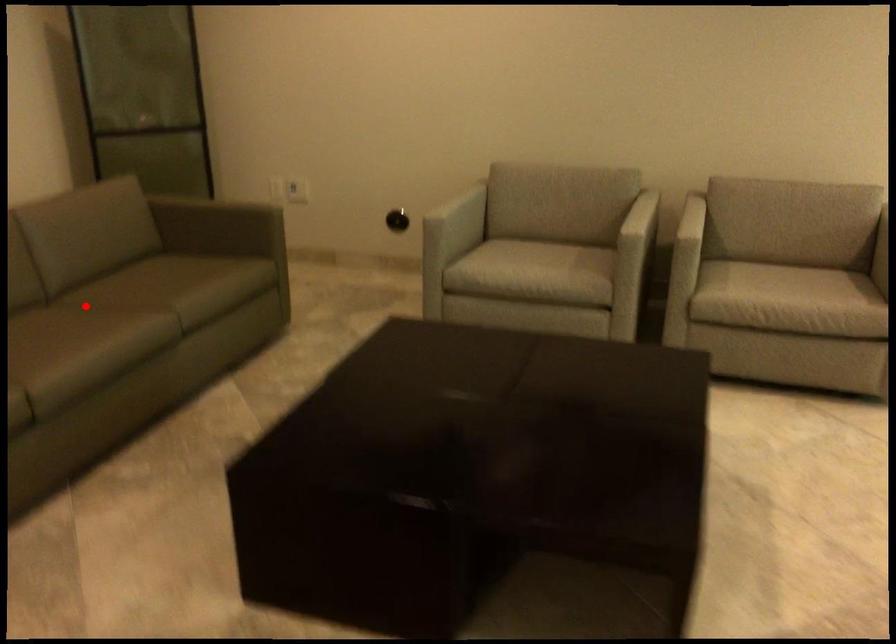
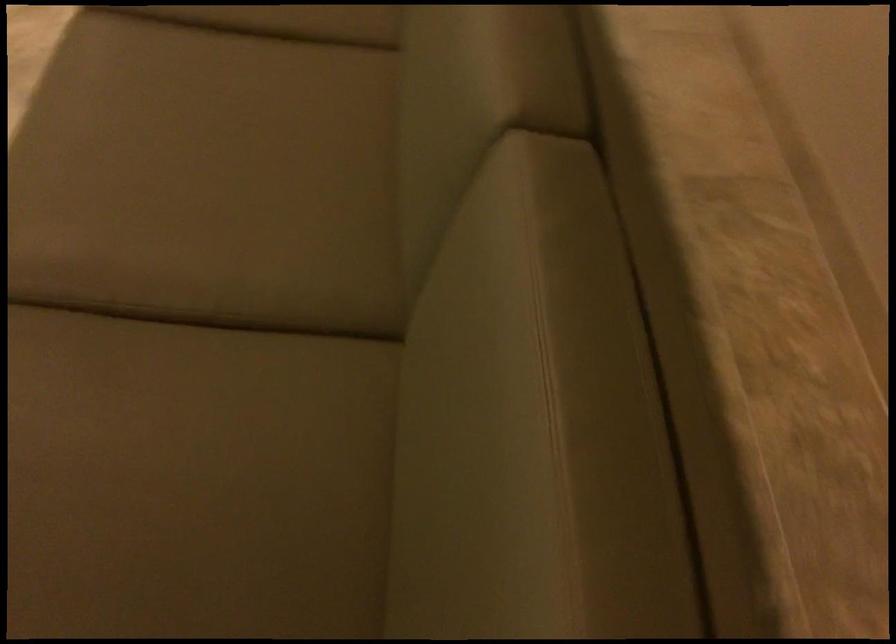
Question: A red point is marked in image1. In image2, is the corresponding 3D point closer to the camera or farther? Reply with the corresponding letter.

Choices:
 (A) The corresponding 3D point is closer.
 (B) The corresponding 3D point is farther.

Answer: (A)